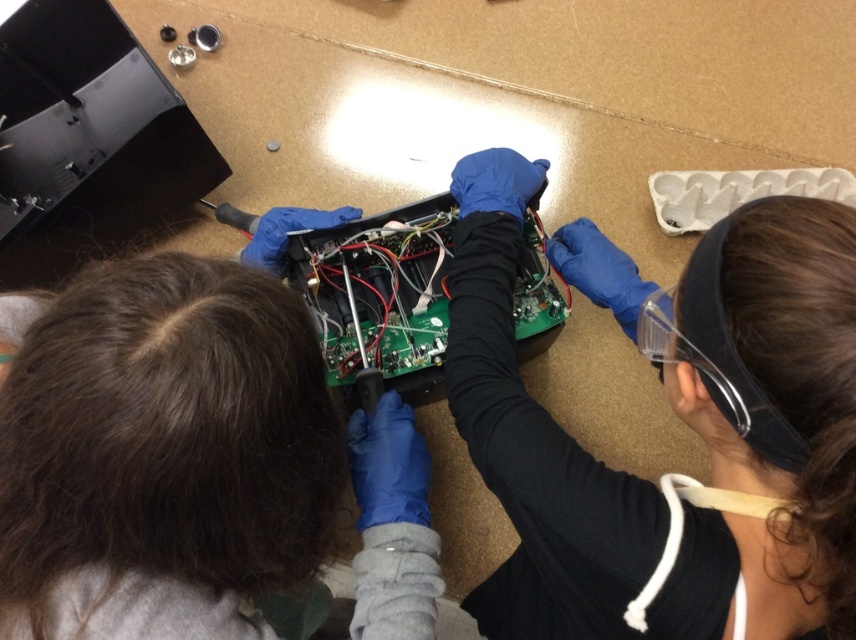
At what (x,y) coordinates should I click in order to perform the action: click on matte black circuit board at center. Please return your answer as a coordinate pair (x, y). The width and height of the screenshot is (856, 640). Looking at the image, I should click on (678, 416).

The height and width of the screenshot is (640, 856). What are the coordinates of `matte black circuit board at center` in the screenshot? It's located at (678, 416).